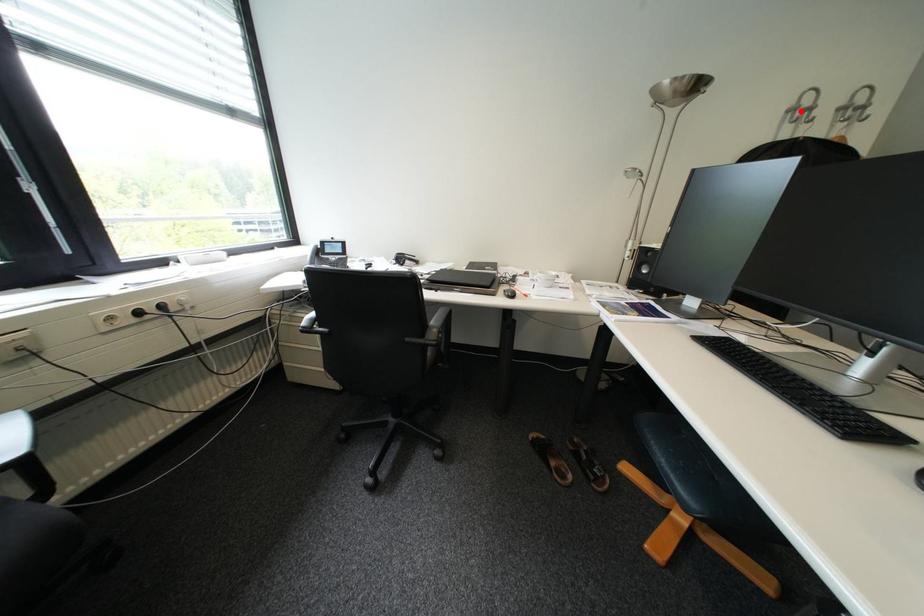
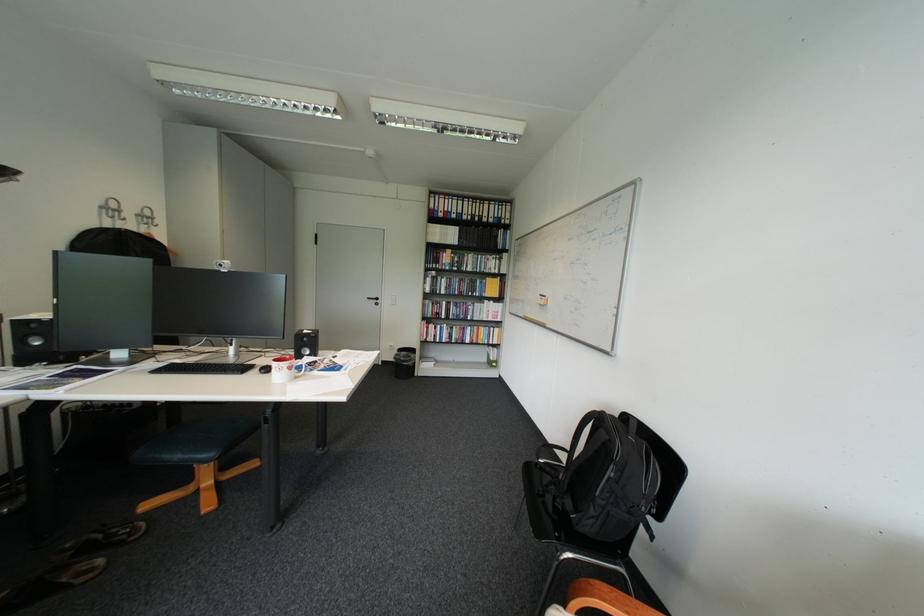
The point at the highlighted location is marked in the first image. Where is the corresponding point in the second image?

(114, 208)